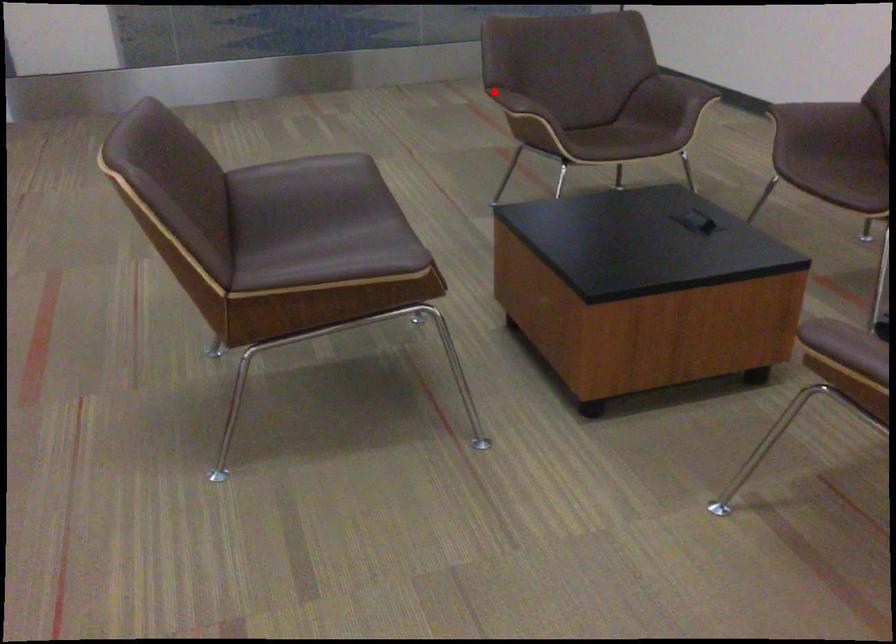
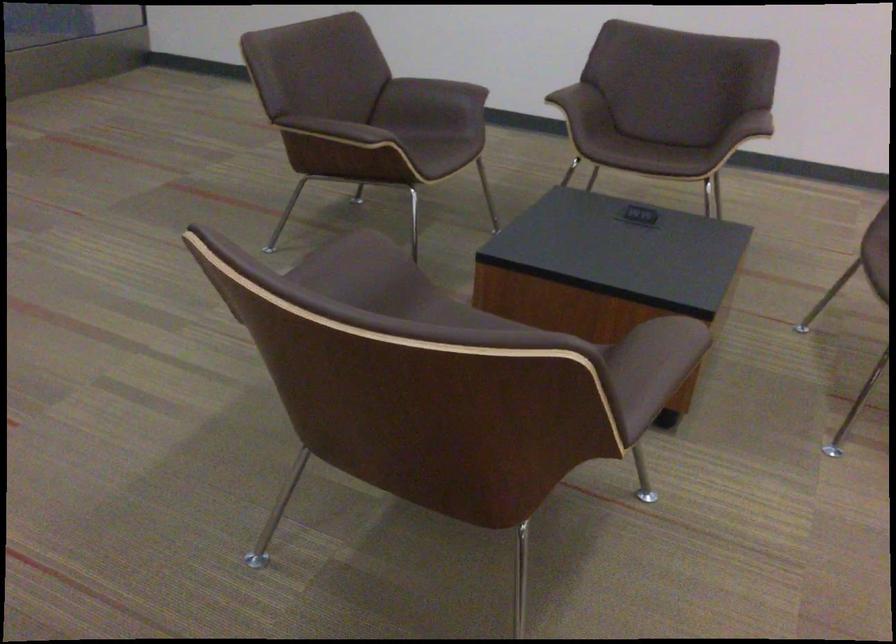
Locate, in the second image, the point that corresponds to the highlighted location in the first image.

(334, 129)